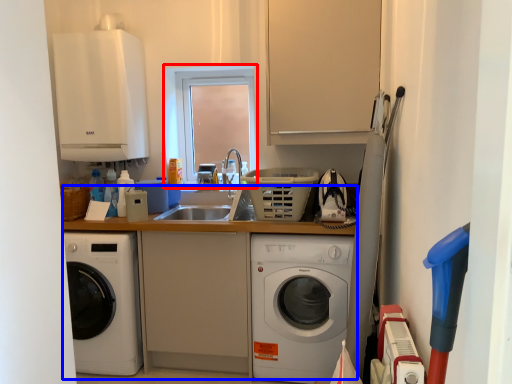
Question: Which point is closer to the camera, window (highlighted by a red box) or counter top (highlighted by a blue box)?

Choices:
 (A) window
 (B) counter top

Answer: (B)